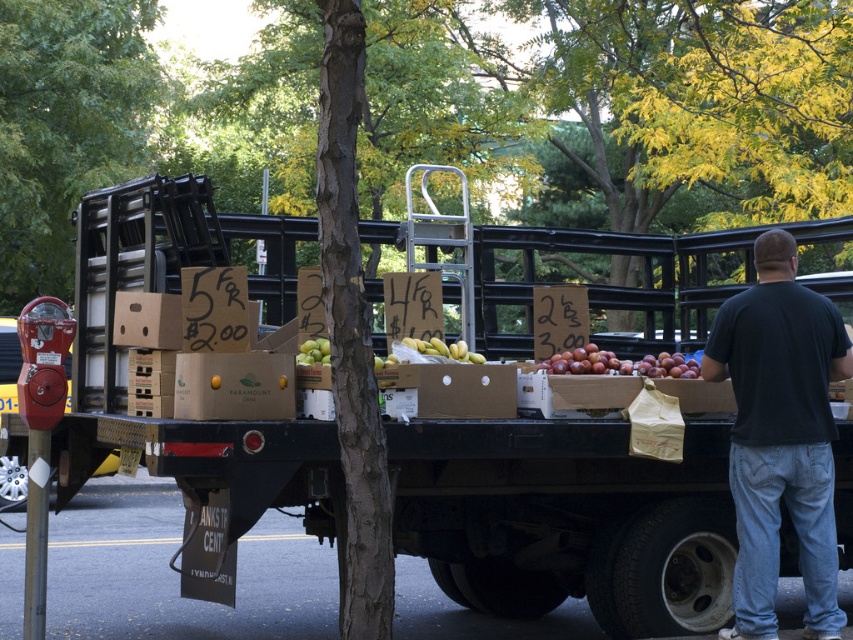
Question: Which point is farther to the camera?

Choices:
 (A) (795, 499)
 (B) (335, 484)

Answer: (A)

Question: Does brown cardboard boxes at center appear over black cotton shirt at right?

Choices:
 (A) yes
 (B) no

Answer: (B)

Question: Does brown cardboard boxes at center appear over black cotton shirt at right?

Choices:
 (A) no
 (B) yes

Answer: (A)

Question: Which object is closer to the camera taking this photo?

Choices:
 (A) brown cardboard boxes at center
 (B) black cotton shirt at right

Answer: (A)

Question: Does brown cardboard boxes at center appear on the right side of black cotton shirt at right?

Choices:
 (A) yes
 (B) no

Answer: (B)